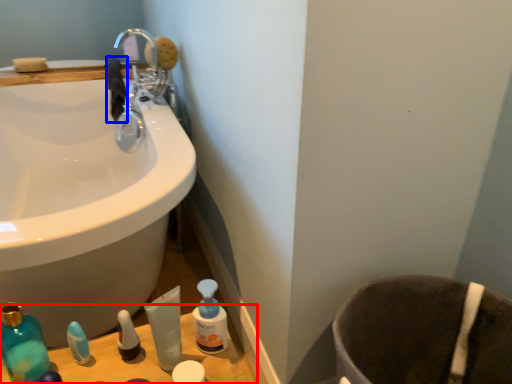
Question: Which of the following is the farthest to the observer, counter top (highlighted by a red box) or hand towel (highlighted by a blue box)?

Choices:
 (A) counter top
 (B) hand towel

Answer: (B)